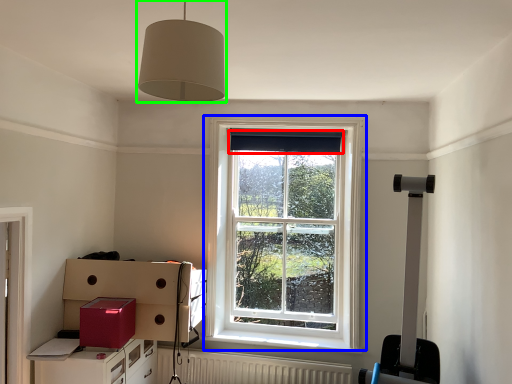
Question: Based on their relative distances, which object is nearer to curtain (highlighted by a red box)? Choose from window (highlighted by a blue box) and light fixture (highlighted by a green box).

Choices:
 (A) window
 (B) light fixture

Answer: (A)